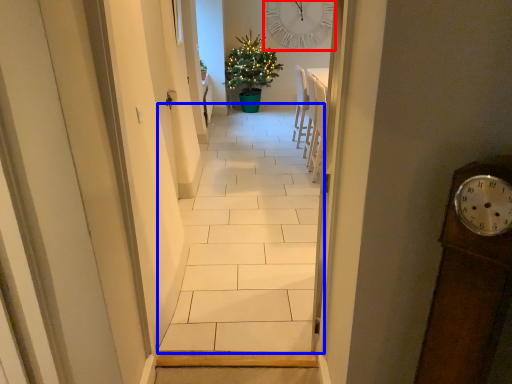
Question: Which object is closer to the camera taking this photo, clock (highlighted by a red box) or path (highlighted by a blue box)?

Choices:
 (A) clock
 (B) path

Answer: (B)